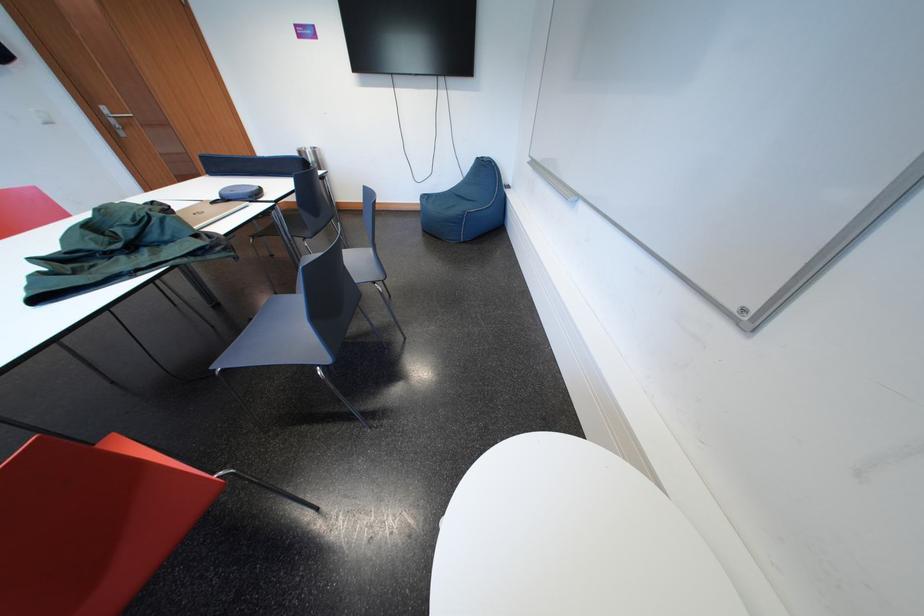
Describe the element at coordinates (115, 119) in the screenshot. The width and height of the screenshot is (924, 616). I see `a silver door handle` at that location.